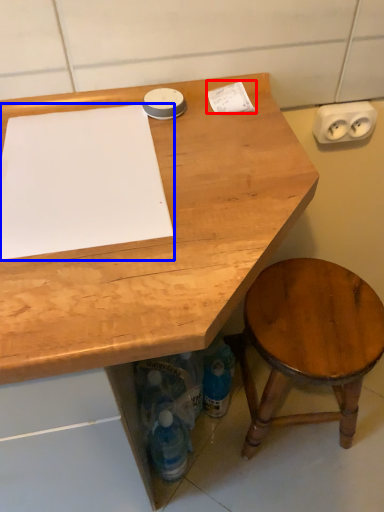
Question: Which point is closer to the camera, notepad (highlighted by a red box) or notepad (highlighted by a blue box)?

Choices:
 (A) notepad
 (B) notepad

Answer: (B)